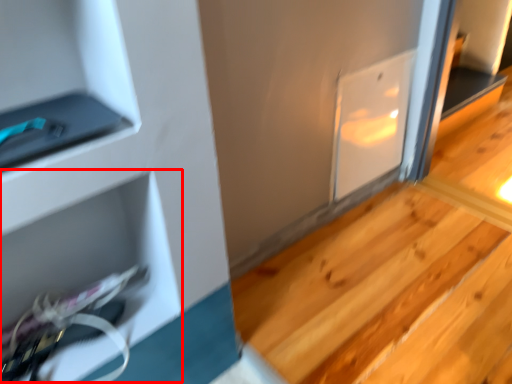
Question: Where is shelf (annotated by the red box) located in relation to stair in the image?

Choices:
 (A) left
 (B) right

Answer: (A)